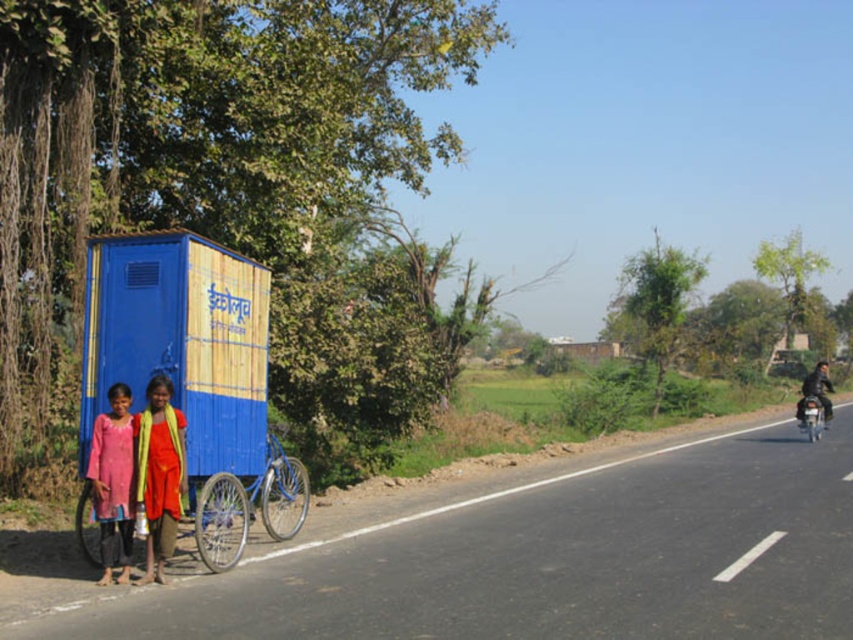
In the scene shown: Does blue matte bicycle at center come in front of shiny metallic motorcycle at right?

Yes, blue matte bicycle at center is in front of shiny metallic motorcycle at right.

Image resolution: width=853 pixels, height=640 pixels. Describe the element at coordinates (248, 508) in the screenshot. I see `blue matte bicycle at center` at that location.

Is point (306, 474) closer to viewer compared to point (809, 417)?

Yes, point (306, 474) is in front of point (809, 417).

Identify the location of blue matte bicycle at center. This screenshot has height=640, width=853. (248, 508).

Can you confirm if pink cotton dress at lower left is positioned below shiny metallic motorcycle at right?

No, pink cotton dress at lower left is not below shiny metallic motorcycle at right.

Can you confirm if pink cotton dress at lower left is positioned to the left of shiny metallic motorcycle at right?

Yes, pink cotton dress at lower left is to the left of shiny metallic motorcycle at right.

Is point (109, 532) closer to camera compared to point (815, 416)?

Yes, point (109, 532) is closer to viewer.

The width and height of the screenshot is (853, 640). I want to click on pink cotton dress at lower left, so click(138, 476).

Is point (160, 380) farther from viewer compared to point (99, 525)?

That is False.

Where is `pink cotton dress at lower left`? The image size is (853, 640). pink cotton dress at lower left is located at coordinates (138, 476).